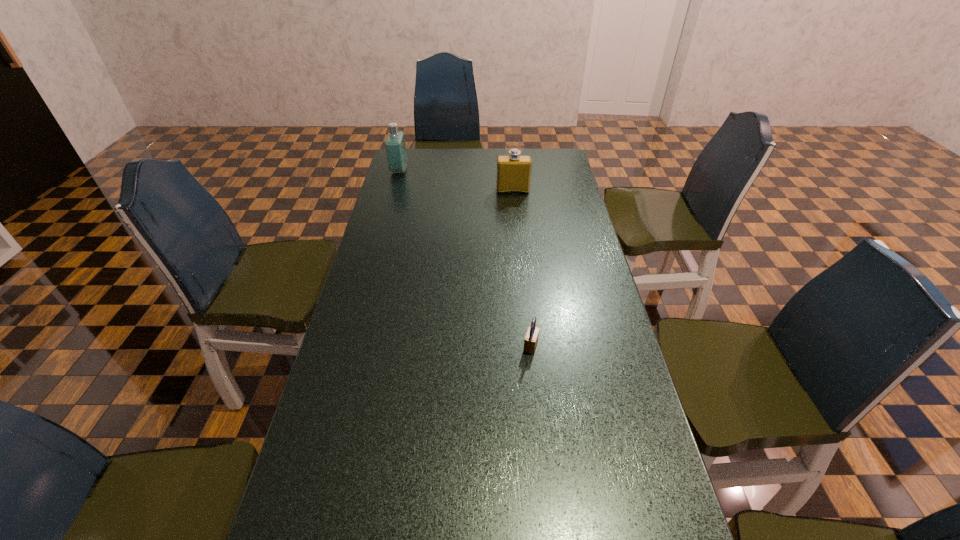
Image resolution: width=960 pixels, height=540 pixels. Find the location of `object positioned at the left edge`. object positioned at the left edge is located at coordinates [x=395, y=145].

Identify the location of object at the far left corner. The image size is (960, 540). (395, 145).

The width and height of the screenshot is (960, 540). I want to click on free space at the far edge, so click(x=484, y=152).

At what (x,y) coordinates should I click in order to perform the action: click on vacant space at the left edge of the desktop. Please return your answer as a coordinate pair (x, y). Looking at the image, I should click on tap(398, 190).

Identify the location of vacant space at the right edge of the desktop. [x=540, y=179].

This screenshot has height=540, width=960. I want to click on free region at the far left corner of the desktop, so click(399, 174).

The height and width of the screenshot is (540, 960). In order to click on vacant space at the far right corner in this screenshot , I will do `click(529, 151)`.

This screenshot has height=540, width=960. I want to click on free area in between the nearer perfume and the padlock, so click(521, 268).

The height and width of the screenshot is (540, 960). I want to click on vacant space that is in between the second farthest object and the left perfume, so click(x=456, y=180).

Find the location of a particular element. Image resolution: width=960 pixels, height=540 pixels. vacant point located between the padlock and the second nearest object is located at coordinates (521, 268).